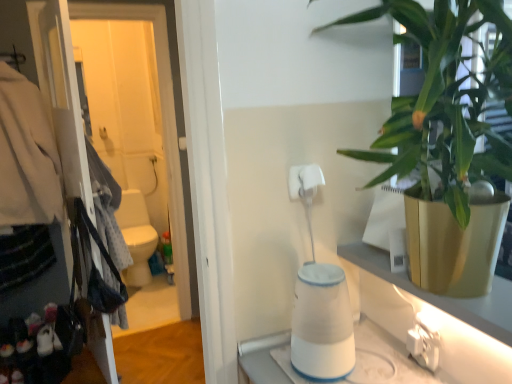
Question: Is green leafy plant at upper right placed right next to matte black coat hanger at left?

Choices:
 (A) no
 (B) yes

Answer: (A)

Question: From the image's perspective, is green leafy plant at upper right on matte black coat hanger at left?

Choices:
 (A) no
 (B) yes

Answer: (B)

Question: Does green leafy plant at upper right come behind matte black coat hanger at left?

Choices:
 (A) no
 (B) yes

Answer: (A)

Question: From a real-world perspective, does green leafy plant at upper right sit lower than matte black coat hanger at left?

Choices:
 (A) no
 (B) yes

Answer: (A)

Question: Considering the relative positions of green leafy plant at upper right and matte black coat hanger at left in the image provided, is green leafy plant at upper right to the right of matte black coat hanger at left from the viewer's perspective?

Choices:
 (A) no
 (B) yes

Answer: (B)

Question: Looking at their shapes, would you say matte black coat hanger at left is wider or thinner than white plastic electric outlet at lower right?

Choices:
 (A) wide
 (B) thin

Answer: (A)

Question: From the image's perspective, is matte black coat hanger at left located above or below white plastic electric outlet at lower right?

Choices:
 (A) above
 (B) below

Answer: (A)

Question: In terms of height, does matte black coat hanger at left look taller or shorter compared to white plastic electric outlet at lower right?

Choices:
 (A) short
 (B) tall

Answer: (B)

Question: Considering the positions of point (15, 150) and point (415, 322), is point (15, 150) closer or farther from the camera than point (415, 322)?

Choices:
 (A) farther
 (B) closer

Answer: (A)

Question: In the image, is matte black coat hanger at left on the left side or the right side of green leafy plant at upper right?

Choices:
 (A) right
 (B) left

Answer: (B)

Question: In terms of height, does matte black coat hanger at left look taller or shorter compared to green leafy plant at upper right?

Choices:
 (A) tall
 (B) short

Answer: (A)

Question: Would you say matte black coat hanger at left is inside or outside green leafy plant at upper right?

Choices:
 (A) outside
 (B) inside

Answer: (A)

Question: In terms of width, does matte black coat hanger at left look wider or thinner when compared to green leafy plant at upper right?

Choices:
 (A) wide
 (B) thin

Answer: (B)

Question: Is point (156, 16) positioned closer to the camera than point (303, 183)?

Choices:
 (A) farther
 (B) closer

Answer: (A)

Question: Relative to white matte toilet paper at center, is white glossy screen door at left in front or behind?

Choices:
 (A) front
 (B) behind

Answer: (B)